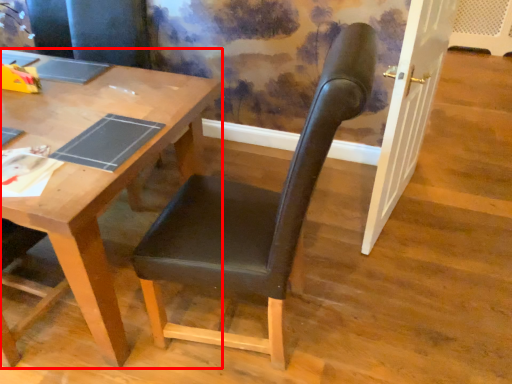
Question: Considering the relative positions of desk (annotated by the red box) and chair in the image provided, where is desk (annotated by the red box) located with respect to the staircase?

Choices:
 (A) left
 (B) right

Answer: (A)